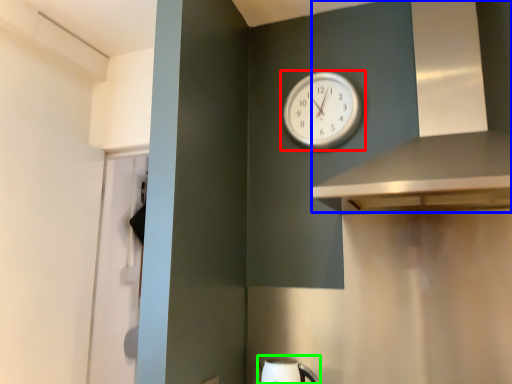
Question: Considering the real-world distances, which object is farthest from wall clock (highlighted by a red box)? vent (highlighted by a blue box) or sink (highlighted by a green box)?

Choices:
 (A) vent
 (B) sink

Answer: (B)